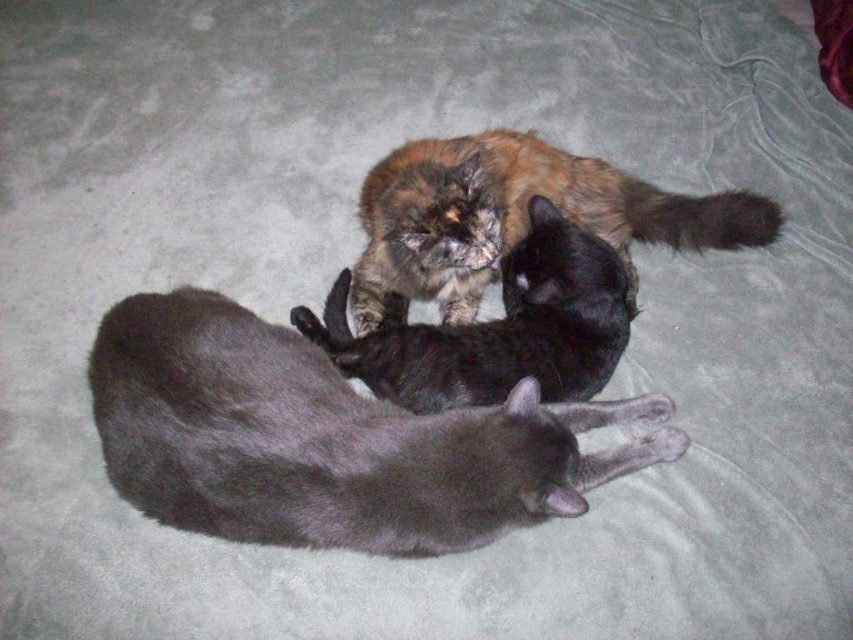
Question: Among these objects, which one is nearest to the camera?

Choices:
 (A) multicolored fur cat at center
 (B) silky gray cat at center

Answer: (B)

Question: Does multicolored fur cat at center appear under multicolored fluffy cat at center?

Choices:
 (A) yes
 (B) no

Answer: (B)

Question: Among these objects, which one is nearest to the camera?

Choices:
 (A) multicolored fluffy cat at center
 (B) silky gray cat at center
 (C) multicolored fur cat at center

Answer: (B)

Question: Estimate the real-world distances between objects in this image. Which object is farther from the multicolored fur cat at center?

Choices:
 (A) multicolored fluffy cat at center
 (B) silky gray cat at center

Answer: (B)

Question: Is silky gray cat at center further to camera compared to multicolored fluffy cat at center?

Choices:
 (A) yes
 (B) no

Answer: (B)

Question: Does multicolored fur cat at center appear under multicolored fluffy cat at center?

Choices:
 (A) no
 (B) yes

Answer: (A)